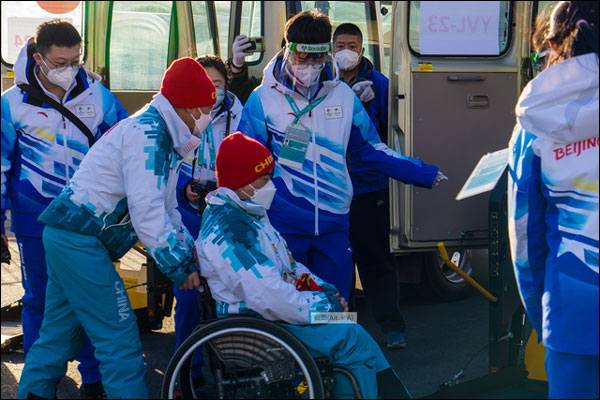
Find the location of a particular element. frame of wheelchair is located at coordinates (356, 384).